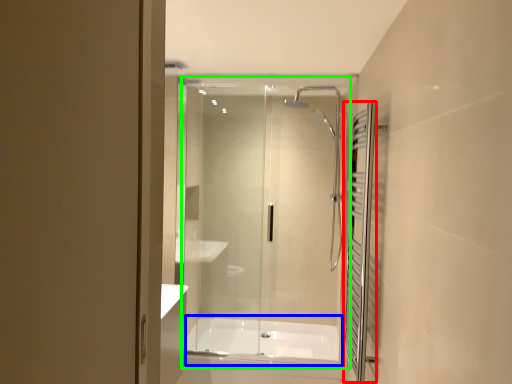
Question: Which object is positioned farthest from shower curtain (highlighted by a red box)? Select from bath (highlighted by a blue box) and glass door (highlighted by a green box).

Choices:
 (A) bath
 (B) glass door

Answer: (A)